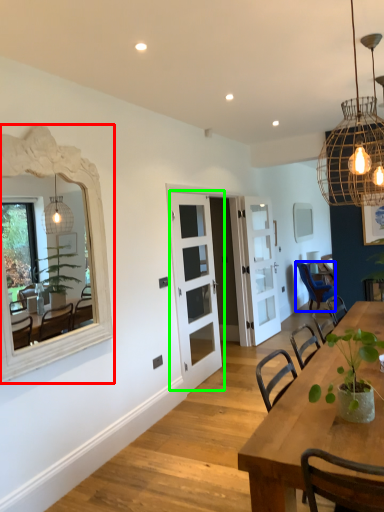
Question: Which object is the closest to the mirror (highlighted by a red box)? Choose among these: chair (highlighted by a blue box) or door (highlighted by a green box).

Choices:
 (A) chair
 (B) door

Answer: (B)